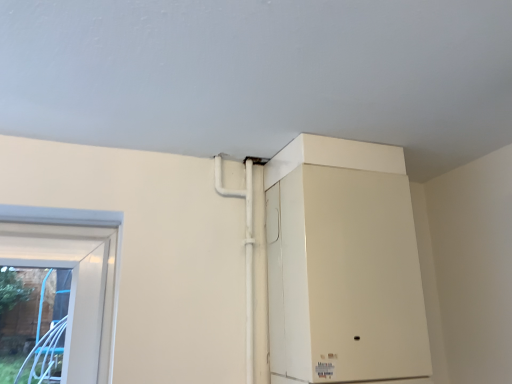
Where is `white matte cabinet at upper right`? white matte cabinet at upper right is located at coordinates (343, 264).

The height and width of the screenshot is (384, 512). Describe the element at coordinates (343, 264) in the screenshot. I see `white matte cabinet at upper right` at that location.

Measure the distance between point (379, 326) and camera.

The distance of point (379, 326) from camera is 3.92 feet.

The width and height of the screenshot is (512, 384). I want to click on white matte cabinet at upper right, so click(343, 264).